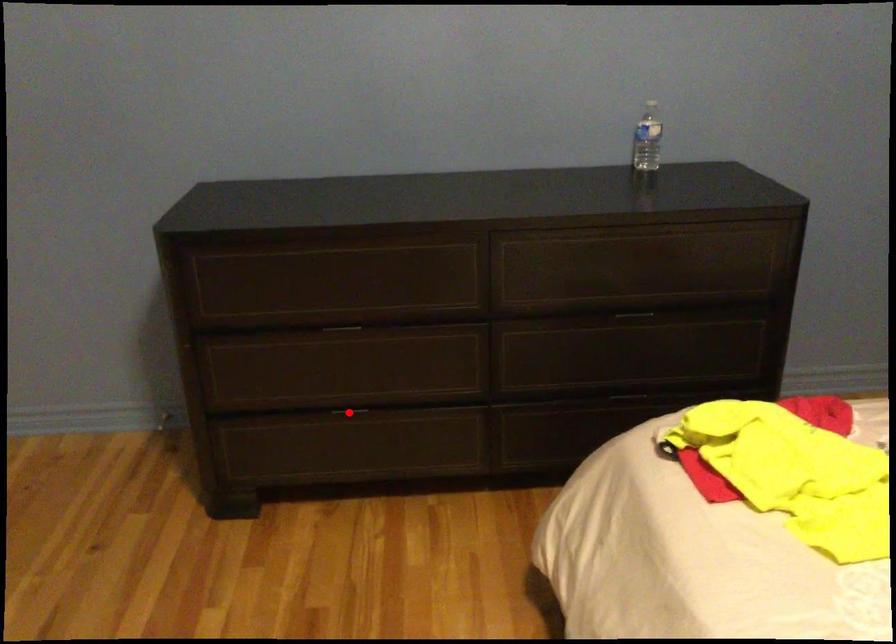
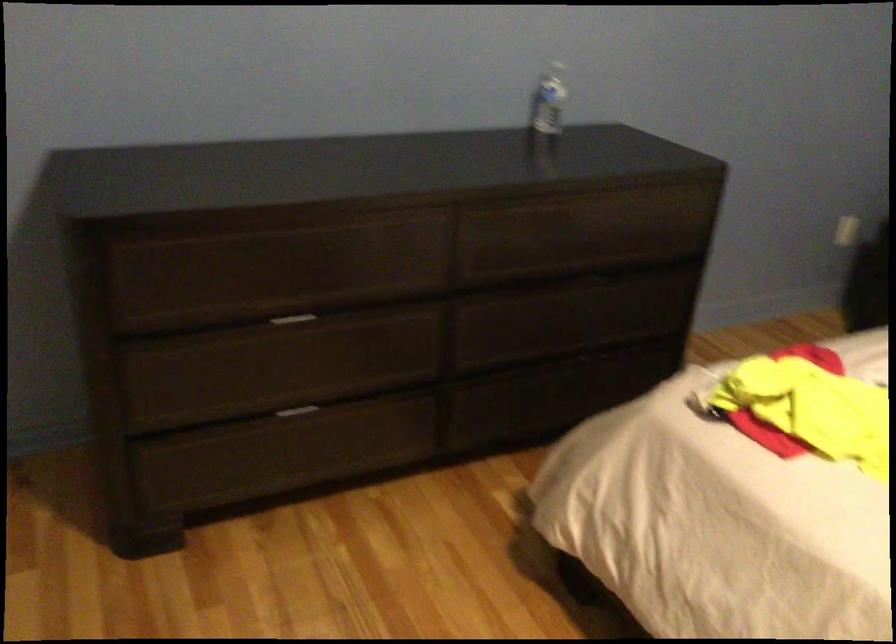
Question: A red point is marked in image1. In image2, is the corresponding 3D point closer to the camera or farther? Reply with the corresponding letter.

Choices:
 (A) The corresponding 3D point is closer.
 (B) The corresponding 3D point is farther.

Answer: (A)